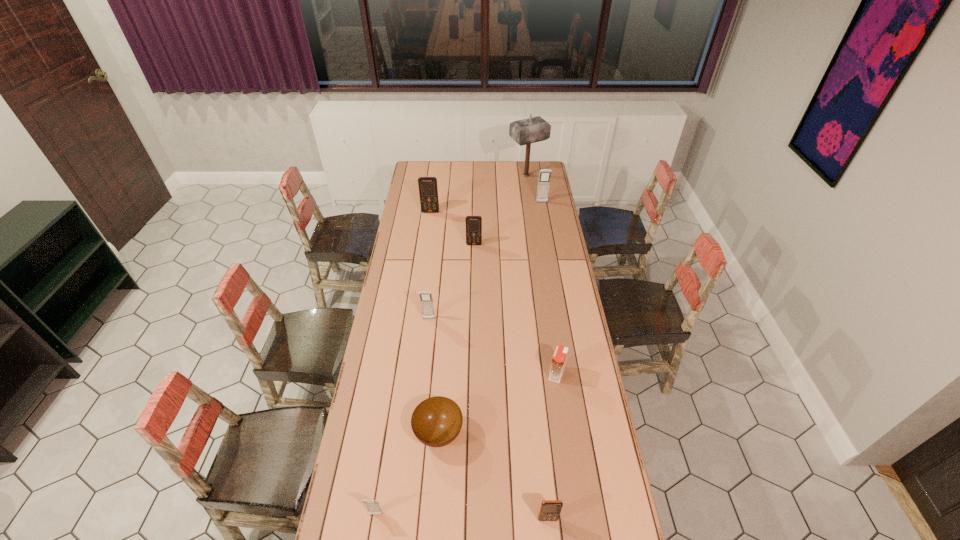
This screenshot has height=540, width=960. I want to click on the sixth farthest object, so click(559, 358).

The image size is (960, 540). I want to click on orange juice, so click(x=559, y=358).

At what (x,y) coordinates should I click in order to perform the action: click on the rightmost orange cellular telephone. Please return your answer as a coordinate pair (x, y). Looking at the image, I should click on (550, 510).

I want to click on the second cellular telephone from right to left, so click(x=550, y=510).

The width and height of the screenshot is (960, 540). Find the location of `the nearest gray cellular telephone`. the nearest gray cellular telephone is located at coordinates (373, 506).

Locate an element on the screen. the leftmost gray cellular telephone is located at coordinates (373, 506).

Locate an element on the screen. The width and height of the screenshot is (960, 540). the shortest object is located at coordinates [436, 422].

Locate an element on the screen. bowl is located at coordinates (436, 422).

Find the location of a particular element. Image resolution: width=960 pixels, height=540 pixels. free space located 0.330m on the left of the farthest object is located at coordinates (454, 176).

Locate an element on the screen. Image resolution: width=960 pixels, height=540 pixels. free region located 0.150m on the front-facing side of the rightmost cellular telephone is located at coordinates 545,220.